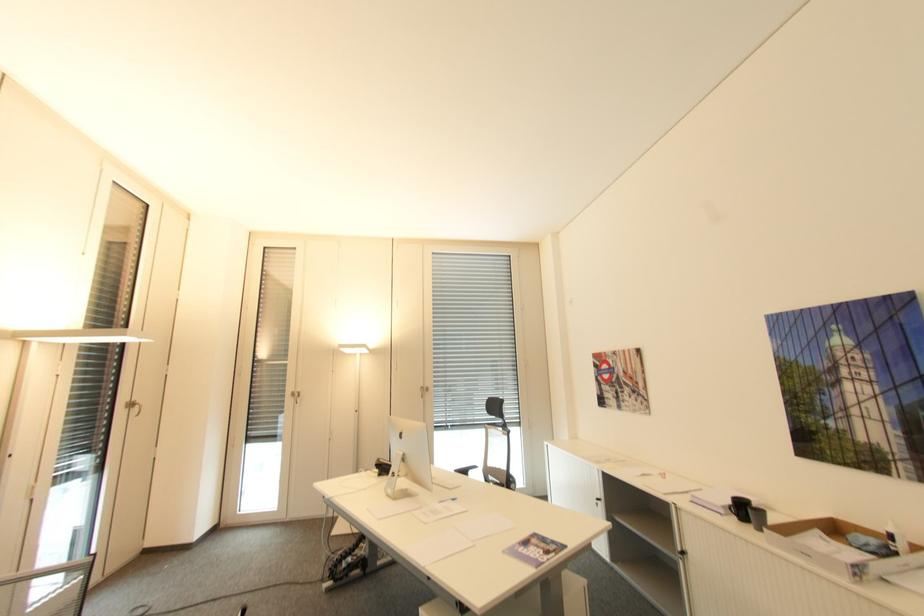
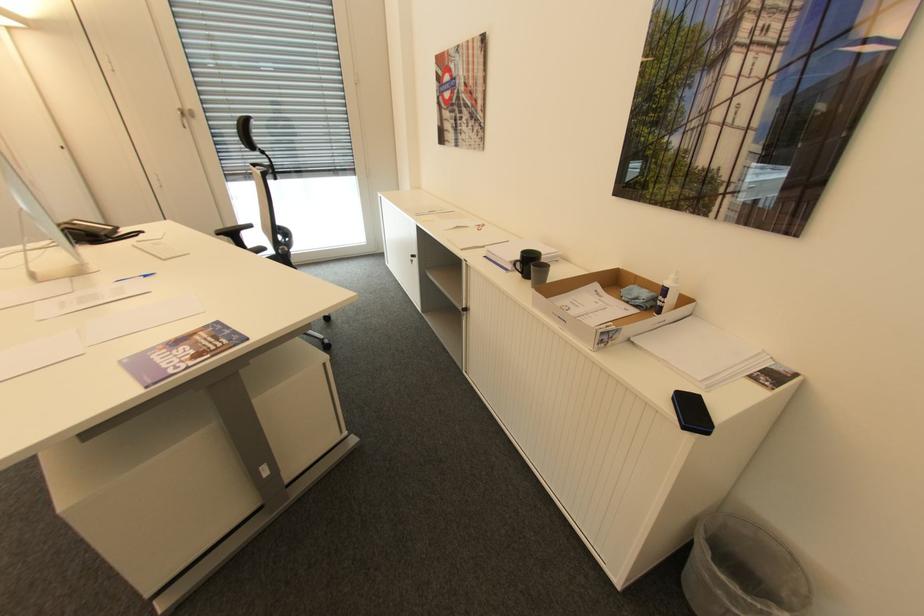
Where in the second image is the point corresponding to [766,513] from the first image?

(550, 268)